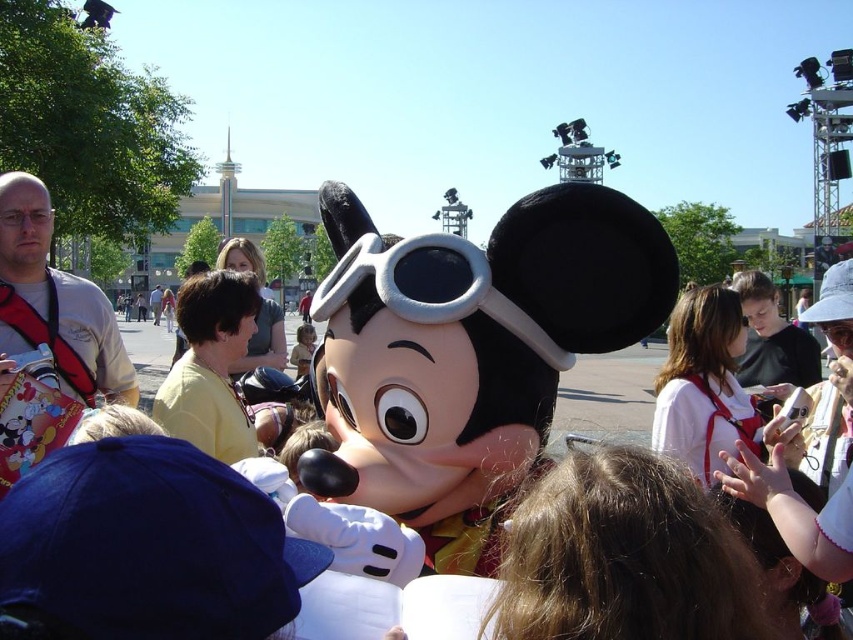
Can you confirm if matte black plush at center is positioned to the left of soft gray fabric goggles at center?

In fact, matte black plush at center is to the right of soft gray fabric goggles at center.

Is matte black plush at center shorter than soft gray fabric goggles at center?

Incorrect, matte black plush at center's height does not fall short of soft gray fabric goggles at center's.

Is point (343, 429) positioned before point (428, 305)?

No, (343, 429) is behind (428, 305).

Find the location of a particular element. matte black plush at center is located at coordinates (473, 349).